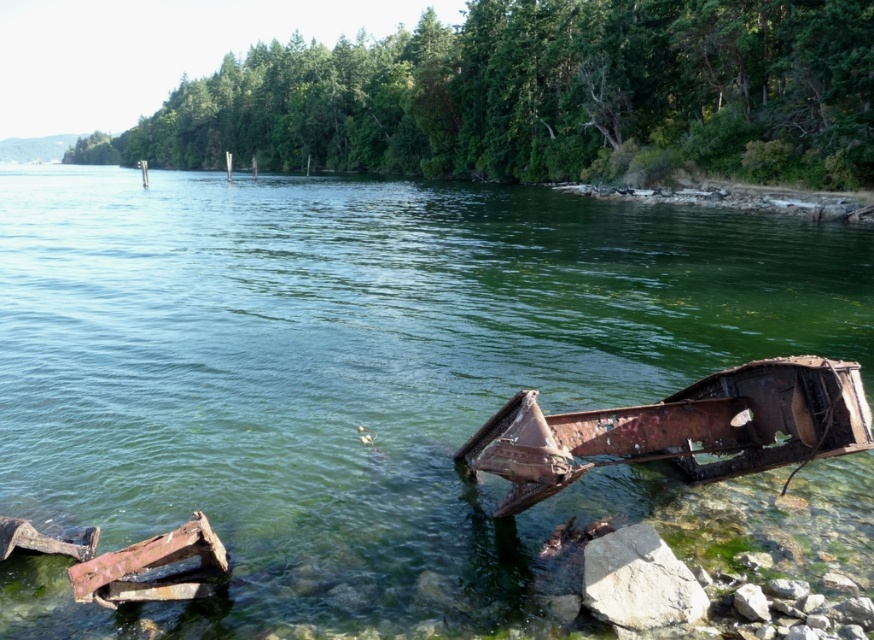
Question: Which point appears farthest from the camera in this image?

Choices:
 (A) (675, 566)
 (B) (245, 600)
 (C) (519, 390)

Answer: (C)

Question: Is green rusty metal car at lower right wider than rusty metal boat at lower right?

Choices:
 (A) yes
 (B) no

Answer: (A)

Question: Among these points, which one is nearest to the camera?

Choices:
 (A) (657, 625)
 (B) (54, 340)

Answer: (A)

Question: Does green rusty metal car at lower right come in front of gray rough rock at lower right?

Choices:
 (A) yes
 (B) no

Answer: (B)

Question: Which of the following is the farthest from the observer?

Choices:
 (A) rusty metal boat at lower right
 (B) gray rough rock at lower right
 (C) green rusty metal car at lower right

Answer: (C)

Question: Can you confirm if green rusty metal car at lower right is positioned above rusty metal boat at lower right?

Choices:
 (A) yes
 (B) no

Answer: (A)